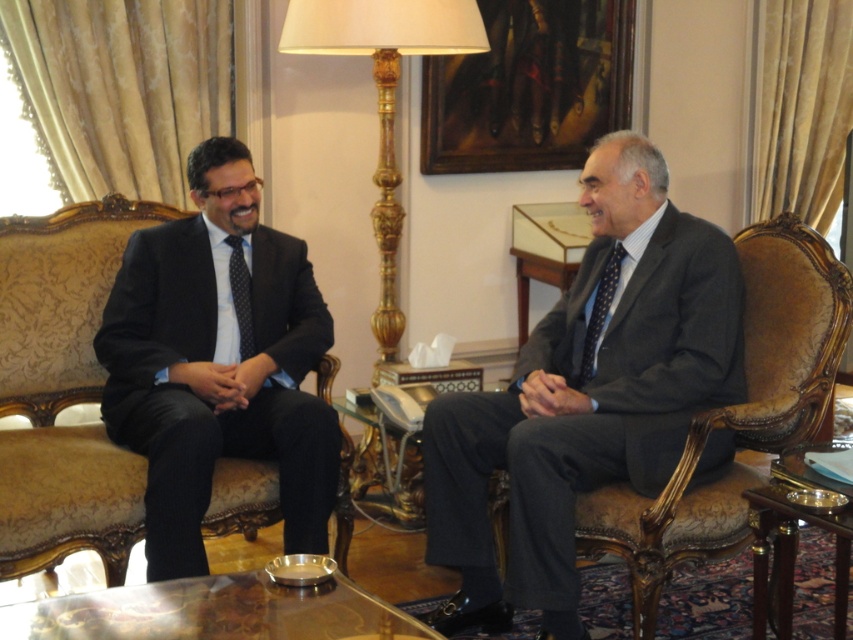
You are a photographer positioned at the camera. You see two points in the scene, point (248, 216) and point (596, 292). Which point is closer to your camera?

Point (248, 216) is further to the camera than point (596, 292).

You are a photographer setting up a shoot in this meeting room. You need to position a light source to the left of the dark gray textured suit at right and the gold polished wood floor lamp at center. Is this possible based on their current positions?

The dark gray textured suit at right is to the right of the gold polished wood floor lamp at center. Therefore, placing a light source to the left of both would require positioning it to the left of the gold polished wood floor lamp at center, as it is already to the left of the dark gray textured suit at right.

You are a photographer setting up a shoot in this meeting room. You need to position a camera on a tripod that requires at least 1.8 meters of clearance height. Given the dark gray textured suit at right and the gold polished wood floor lamp at center, which object is more likely to interfere with the camera setup?

The gold polished wood floor lamp at center is taller than the dark gray textured suit at right, so it is more likely to interfere with the camera setup requiring 1.8 meters of clearance height.